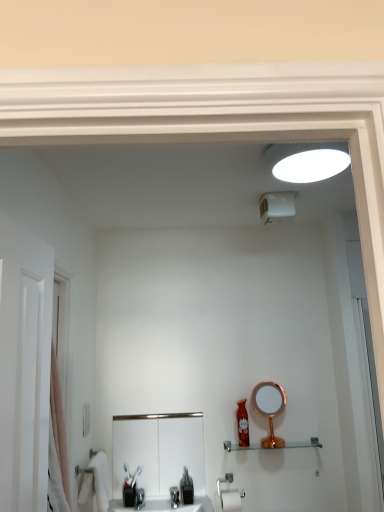
Where is `free space above satin nickel sink at center (from a real-world perspective)`? This screenshot has height=512, width=384. free space above satin nickel sink at center (from a real-world perspective) is located at coordinates (155, 414).